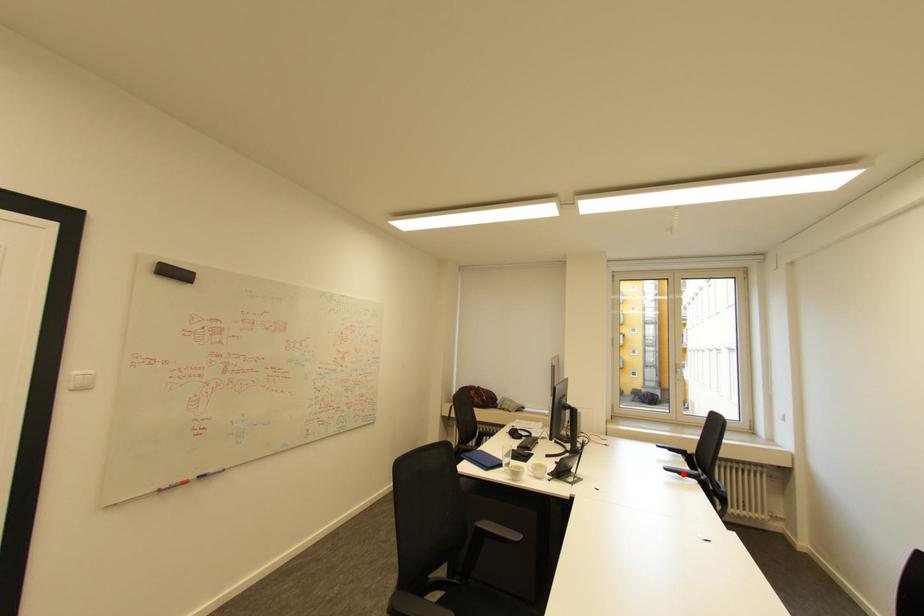
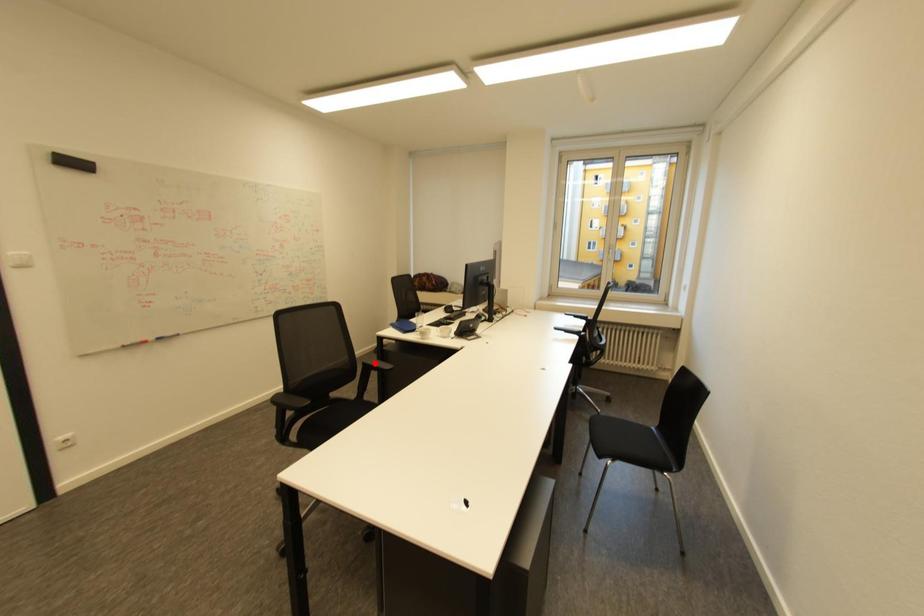
I am providing you with two images of the same scene from different viewpoints. A red point is marked on the first image and another point is marked on the second image. Are the points marked in image1 and image2 representing the same 3D position?

No